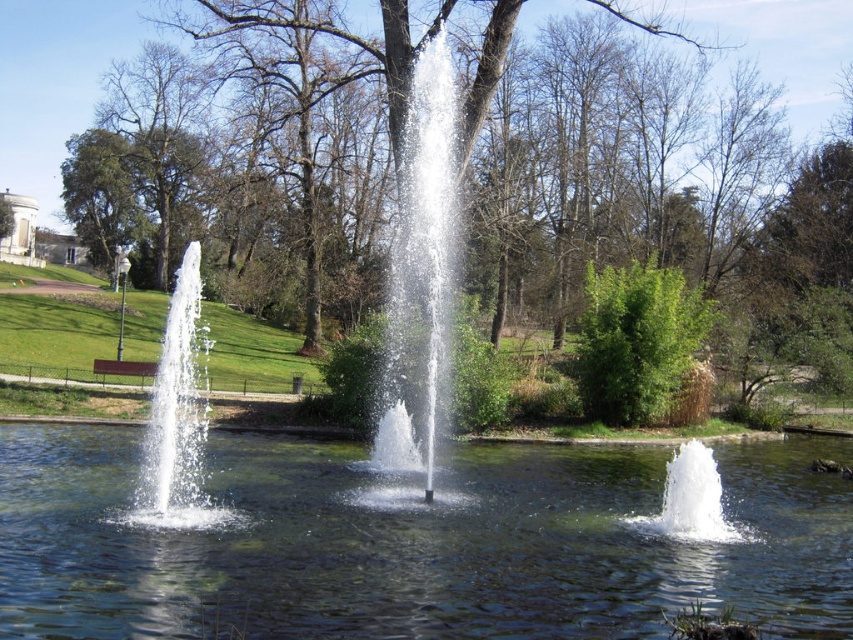
Question: In this image, where is green leafy tree at center located relative to clear water fountain at left?

Choices:
 (A) left
 (B) right

Answer: (B)

Question: Among these objects, which one is farthest from the camera?

Choices:
 (A) clear water fountain at center
 (B) clear water at center

Answer: (A)

Question: Does clear water at center lie behind green leafy tree at center?

Choices:
 (A) yes
 (B) no

Answer: (B)

Question: Does clear water at center have a greater width compared to clear water fountain at left?

Choices:
 (A) no
 (B) yes

Answer: (B)

Question: Which point is closer to the camera?

Choices:
 (A) green leafy tree at center
 (B) clear water fountain at center
 (C) clear glass fountain at lower right

Answer: (C)

Question: Among these points, which one is farthest from the camera?

Choices:
 (A) (189, 406)
 (B) (671, 520)

Answer: (B)